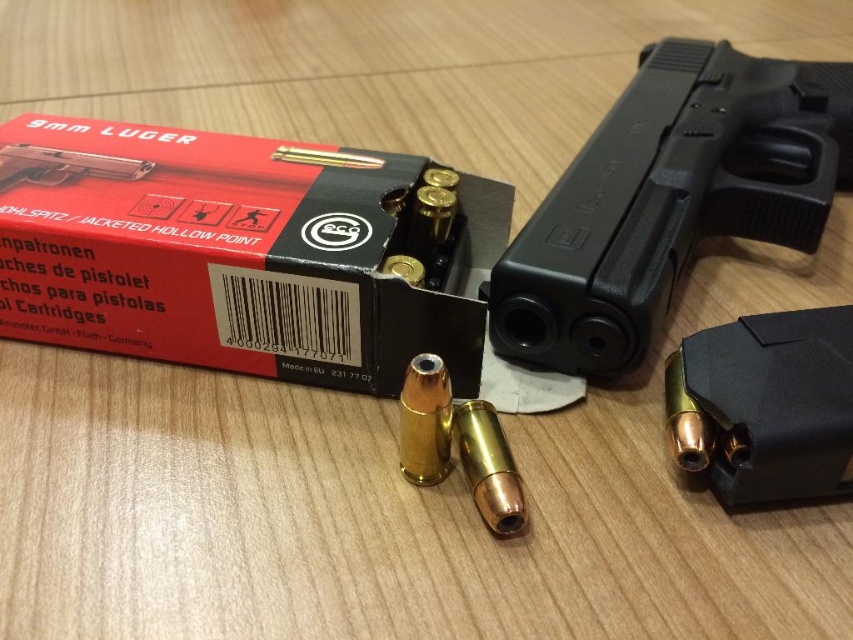
You are a security guard inspecting a table with a red matte box at upper left and a black plastic handgun at upper right. Which object is positioned higher on the table?

The black plastic handgun at upper right is higher than the red matte box at upper left because the red matte box at upper left is located below it.